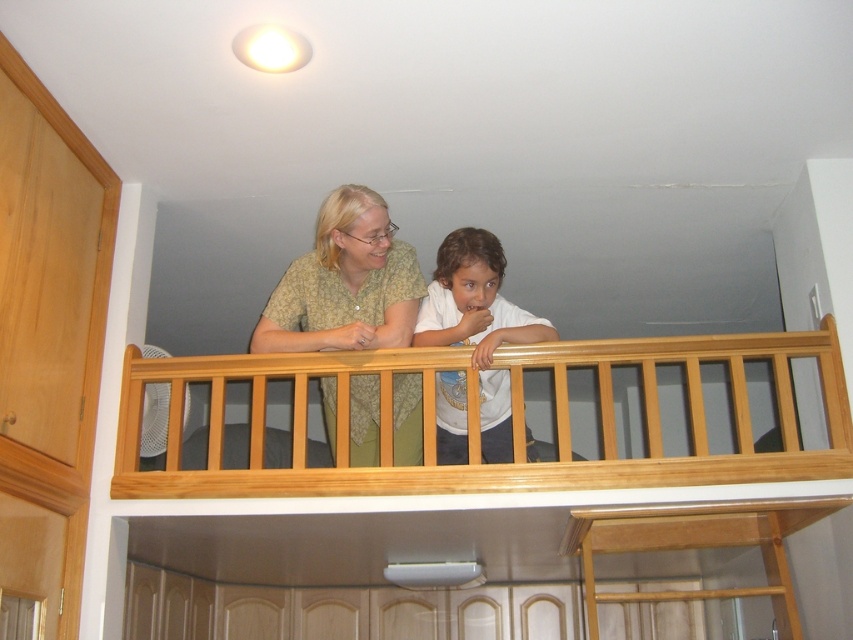
Identify the location of light brown wood at upper center. This screenshot has height=640, width=853. (477, 419).

At what (x,y) coordinates should I click in order to perform the action: click on light brown wood at upper center. Please return your answer as a coordinate pair (x, y). Looking at the image, I should click on (477, 419).

The width and height of the screenshot is (853, 640). In order to click on light brown wood at upper center in this screenshot , I will do `click(477, 419)`.

Measure the distance between green matte shirt at upper center and white matte shirt at center.

green matte shirt at upper center is 10.60 inches away from white matte shirt at center.

Image resolution: width=853 pixels, height=640 pixels. What are the coordinates of `green matte shirt at upper center` in the screenshot? It's located at (345, 284).

Is light brown wood at upper center to the right of white matte shirt at center from the viewer's perspective?

In fact, light brown wood at upper center is to the left of white matte shirt at center.

Between light brown wood at upper center and white matte shirt at center, which one has less height?

light brown wood at upper center is shorter.

Is point (746, 349) closer to camera compared to point (461, 413)?

Yes, it is.

The height and width of the screenshot is (640, 853). I want to click on light brown wood at upper center, so click(477, 419).